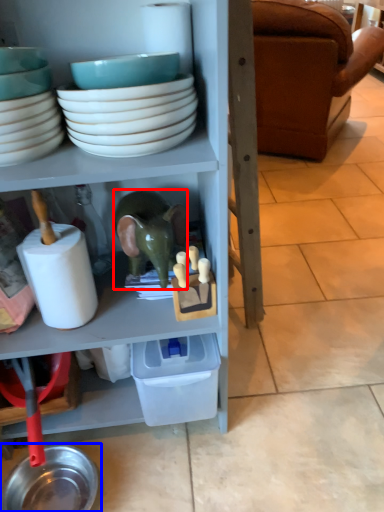
Question: Among these objects, which one is farthest to the camera, toy (highlighted by a red box) or tableware (highlighted by a blue box)?

Choices:
 (A) toy
 (B) tableware

Answer: (B)